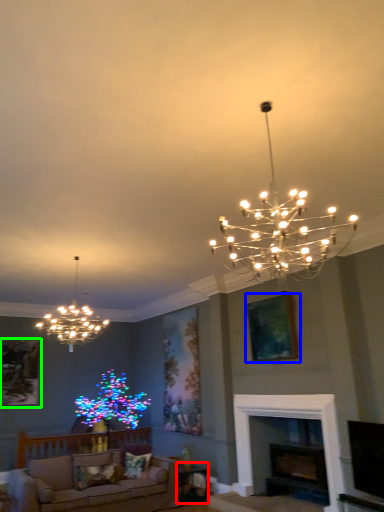
Question: Based on their relative distances, which object is nearer to table (highlighted by a red box)? Choose from picture frame (highlighted by a blue box) and picture frame (highlighted by a green box).

Choices:
 (A) picture frame
 (B) picture frame

Answer: (A)